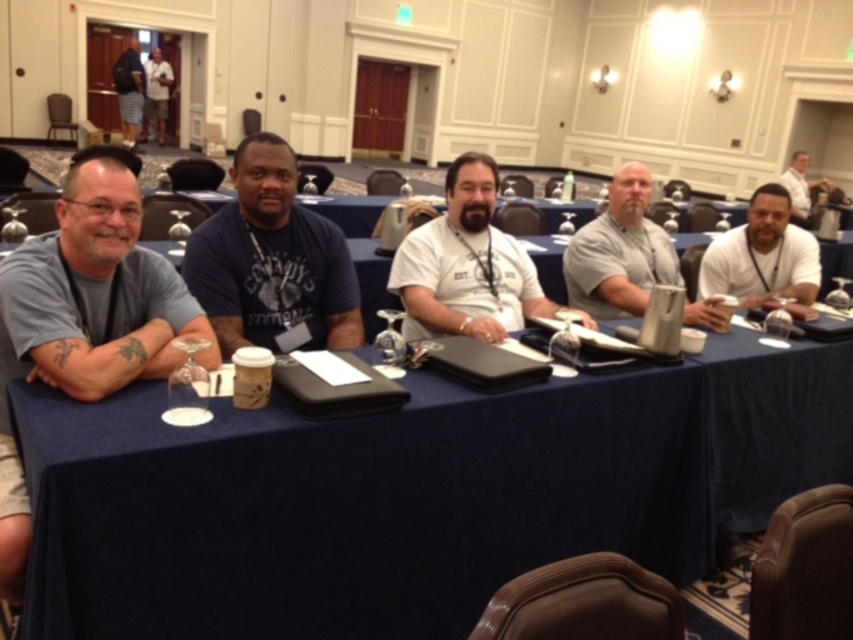
Question: Which point appears farthest from the camera in this image?

Choices:
 (A) (799, 205)
 (B) (613, 216)

Answer: (A)

Question: Observing the image, what is the correct spatial positioning of gray matte shirt at left in reference to white matte shirt at center?

Choices:
 (A) below
 (B) above

Answer: (A)

Question: Is white matte shirt at center above white shirt at upper right?

Choices:
 (A) no
 (B) yes

Answer: (A)

Question: Based on their relative distances, which object is nearer to the white shirt at upper right?

Choices:
 (A) white matte shirt at center
 (B) dark blue t-shirt at upper left
 (C) dark blue t-shirt at center
 (D) gray matte shirt at left

Answer: (A)

Question: Which of the following is the farthest from the observer?

Choices:
 (A) dark blue t-shirt at upper left
 (B) gray matte mug at center

Answer: (A)

Question: Is gray matte shirt at left thinner than dark blue t-shirt at center?

Choices:
 (A) yes
 (B) no

Answer: (A)